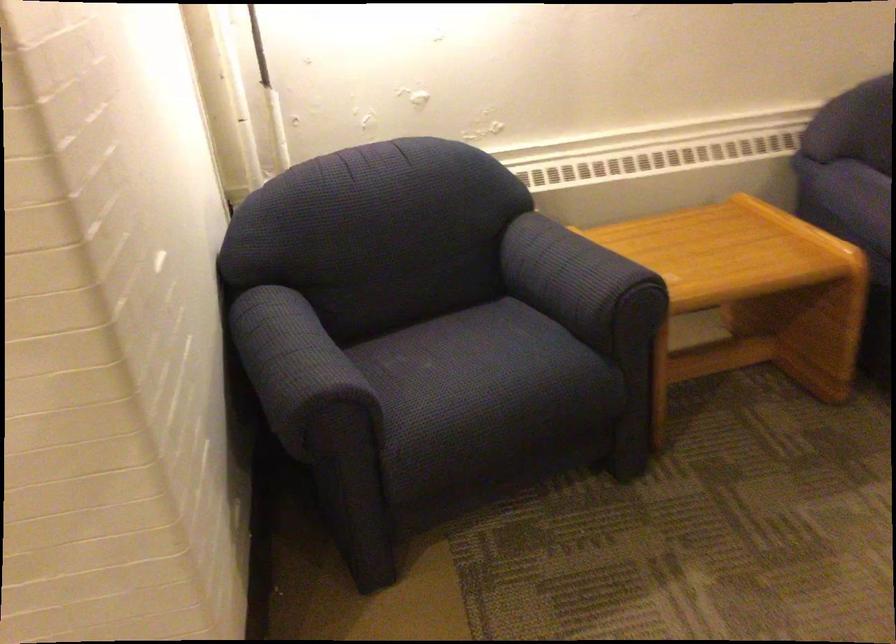
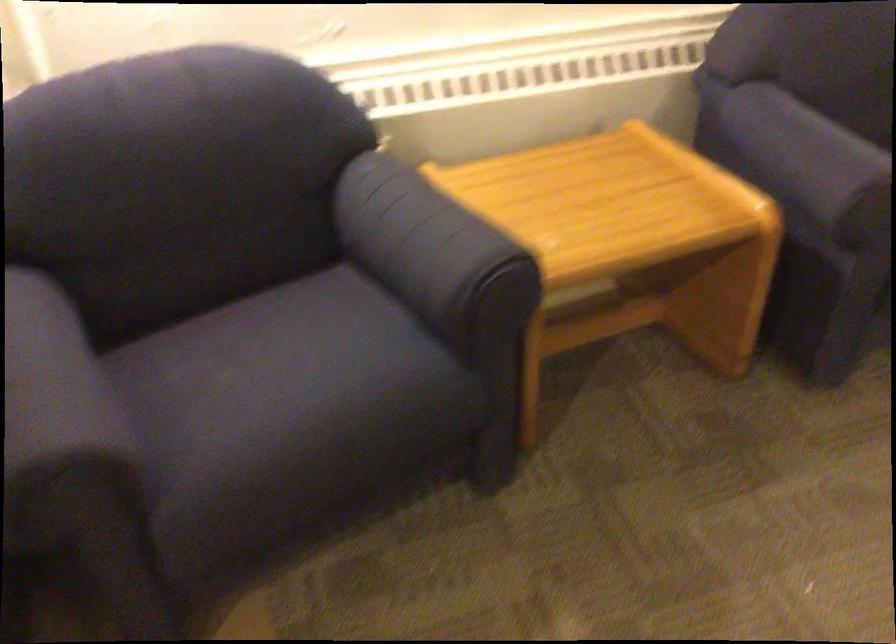
Question: The first image is from the beginning of the video and the second image is from the end. How did the camera likely rotate when shooting the video?

Choices:
 (A) Left
 (B) Right
 (C) Up
 (D) Down

Answer: (D)